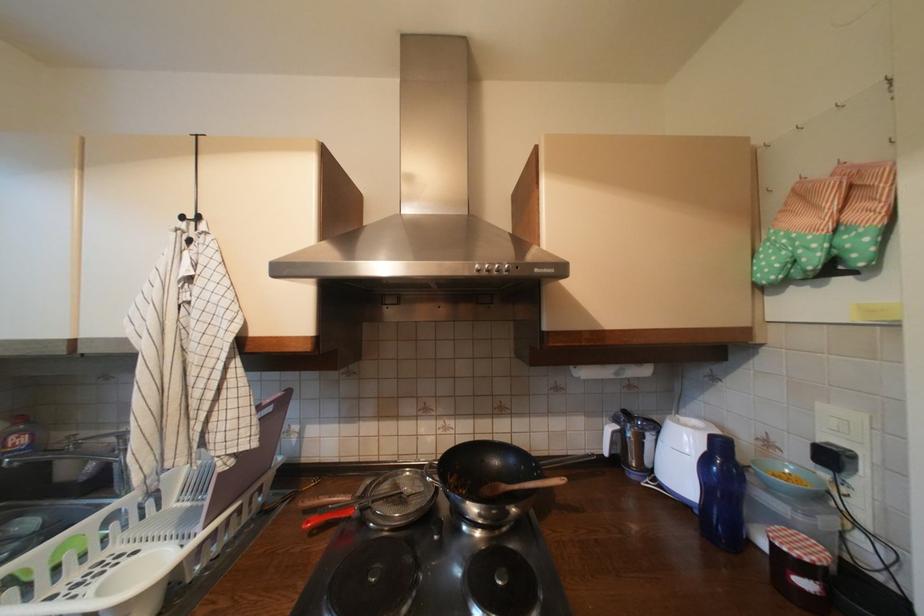
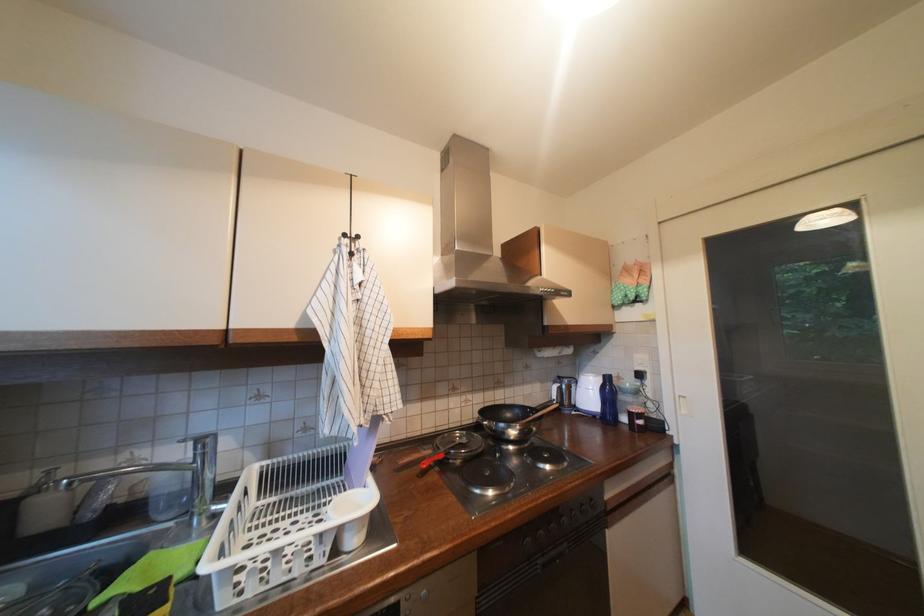
Question: Which direction would the cameraman need to move to produce the second image? Reply with the corresponding letter.

Choices:
 (A) Left
 (B) Right
 (C) Forward
 (D) Backward

Answer: (A)